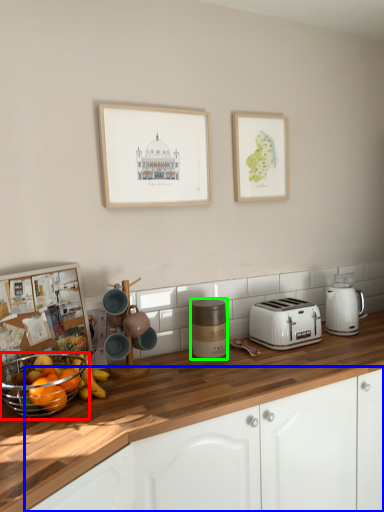
Question: Estimate the real-world distances between objects in this image. Which object is farther from basket (highlighted by a red box), cabinetry (highlighted by a blue box) or appliance (highlighted by a green box)?

Choices:
 (A) cabinetry
 (B) appliance

Answer: (B)